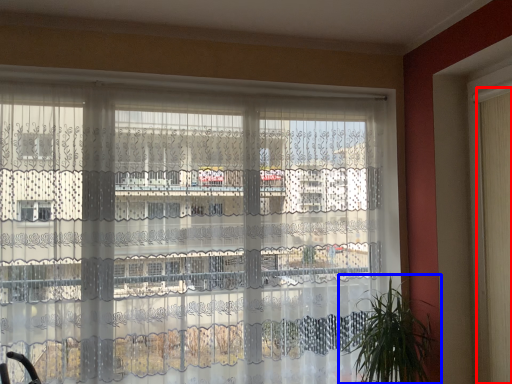
Question: Among these objects, which one is farthest to the camera, shutter (highlighted by a red box) or houseplant (highlighted by a blue box)?

Choices:
 (A) shutter
 (B) houseplant

Answer: (B)